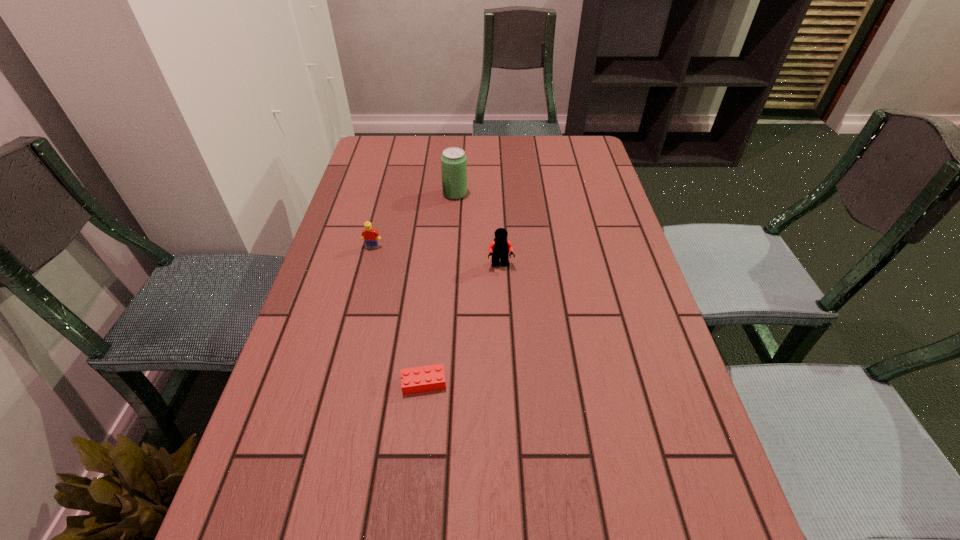
At what (x,y) coordinates should I click in order to perform the action: click on vacant region located on the front-facing side of the second shortest object. Please return your answer as a coordinate pair (x, y). The image size is (960, 540). Looking at the image, I should click on (367, 270).

Locate an element on the screen. The height and width of the screenshot is (540, 960). vacant space located 0.230m on the back of the second Lego from right to left is located at coordinates (433, 291).

Identify the location of object that is at the left edge. The image size is (960, 540). (369, 235).

Locate an element on the screen. The image size is (960, 540). vacant area at the far edge is located at coordinates (494, 141).

Locate an element on the screen. The image size is (960, 540). free space at the left edge of the desktop is located at coordinates (325, 268).

The height and width of the screenshot is (540, 960). What are the coordinates of `free space at the right edge` in the screenshot? It's located at (704, 478).

Locate an element on the screen. vacant space at the far left corner of the desktop is located at coordinates (404, 163).

In the image, there is a desktop. Where is `free space at the far right corner`? This screenshot has height=540, width=960. free space at the far right corner is located at coordinates (587, 140).

This screenshot has height=540, width=960. I want to click on free space between the tallest Lego and the shortest Lego, so click(462, 324).

This screenshot has width=960, height=540. I want to click on empty space that is in between the second shortest object and the rightmost object, so click(x=437, y=256).